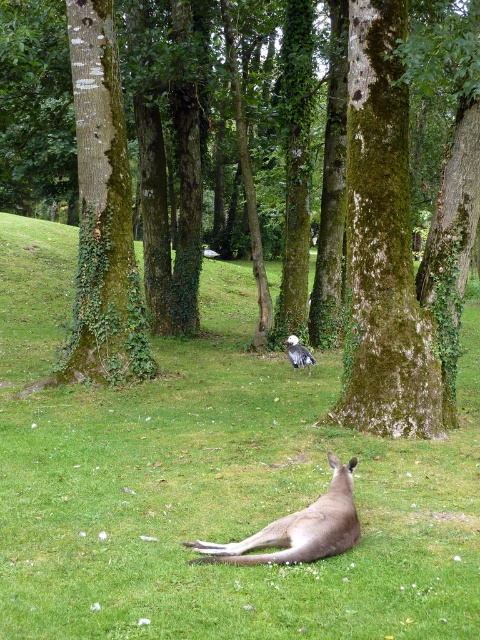
Does green grassy at center have a greater width compared to green mossy tree at center?

Indeed, green grassy at center has a greater width compared to green mossy tree at center.

Between green grassy at center and green mossy tree at center, which one appears on the left side from the viewer's perspective?

green mossy tree at center

The image size is (480, 640). Identify the location of green grassy at center. (212, 483).

Describe the element at coordinates (399, 243) in the screenshot. The image size is (480, 640). I see `green mossy tree at center` at that location.

Which is in front, point (448, 244) or point (319, 541)?

Point (319, 541) is more forward.

Locate an element on the screen. green mossy tree at center is located at coordinates (399, 243).

Locate an element on the screen. green grassy at center is located at coordinates (212, 483).

Who is higher up, green grassy at center or white feathered bird at center?

green grassy at center is higher up.

Where is `green grassy at center`? green grassy at center is located at coordinates (212, 483).

Where is `green grassy at center`? Image resolution: width=480 pixels, height=640 pixels. green grassy at center is located at coordinates (212, 483).